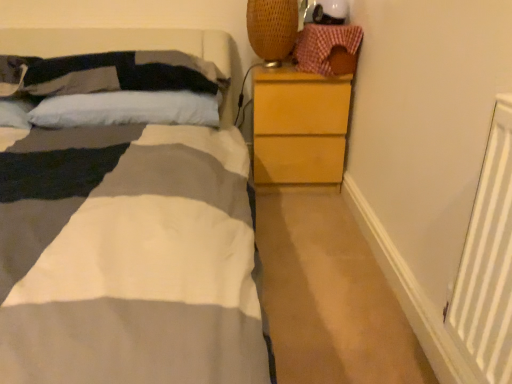
Question: Based on their sizes in the image, would you say soft cotton pillow at upper left, the 1th pillow positioned from the top, is bigger or smaller than white soft pillow at upper left, acting as the 2th pillow starting from the top?

Choices:
 (A) small
 (B) big

Answer: (B)

Question: Visually, is soft cotton pillow at upper left, the 2th pillow in the bottom-to-top sequence, positioned to the left or to the right of white soft pillow at upper left, acting as the 2th pillow starting from the top?

Choices:
 (A) right
 (B) left

Answer: (B)

Question: Estimate the real-world distances between objects in this image. Which object is farther from the soft cotton pillow at upper left, the 2th pillow in the bottom-to-top sequence?

Choices:
 (A) light brown wooden chest of drawers at right
 (B) checkered fabric basket at upper right
 (C) white soft pillow at upper left, the first pillow positioned from the bottom

Answer: (B)

Question: Considering the real-world distances, which object is closest to the white soft pillow at upper left, the first pillow positioned from the bottom?

Choices:
 (A) soft cotton pillow at upper left, the 1th pillow positioned from the top
 (B) light brown wooden chest of drawers at right
 (C) checkered fabric basket at upper right

Answer: (A)